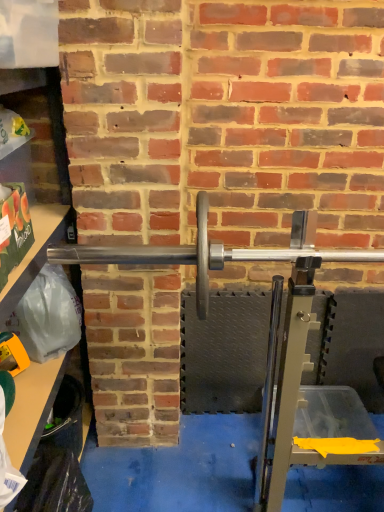
Question: From their relative heights in the image, would you say silver metallic barbell at center is taller or shorter than clear plastic bag at left?

Choices:
 (A) short
 (B) tall

Answer: (A)

Question: In terms of width, does silver metallic barbell at center look wider or thinner when compared to clear plastic bag at left?

Choices:
 (A) thin
 (B) wide

Answer: (A)

Question: From a real-world perspective, is silver metallic barbell at center physically located above or below clear plastic bag at left?

Choices:
 (A) above
 (B) below

Answer: (A)

Question: Choose the correct answer: Is clear plastic bag at left inside silver metallic barbell at center or outside it?

Choices:
 (A) outside
 (B) inside

Answer: (A)

Question: From their relative heights in the image, would you say clear plastic bag at left is taller or shorter than silver metallic barbell at center?

Choices:
 (A) tall
 (B) short

Answer: (A)

Question: In terms of width, does clear plastic bag at left look wider or thinner when compared to silver metallic barbell at center?

Choices:
 (A) thin
 (B) wide

Answer: (B)

Question: From a real-world perspective, relative to silver metallic barbell at center, is clear plastic bag at left vertically above or below?

Choices:
 (A) below
 (B) above

Answer: (A)